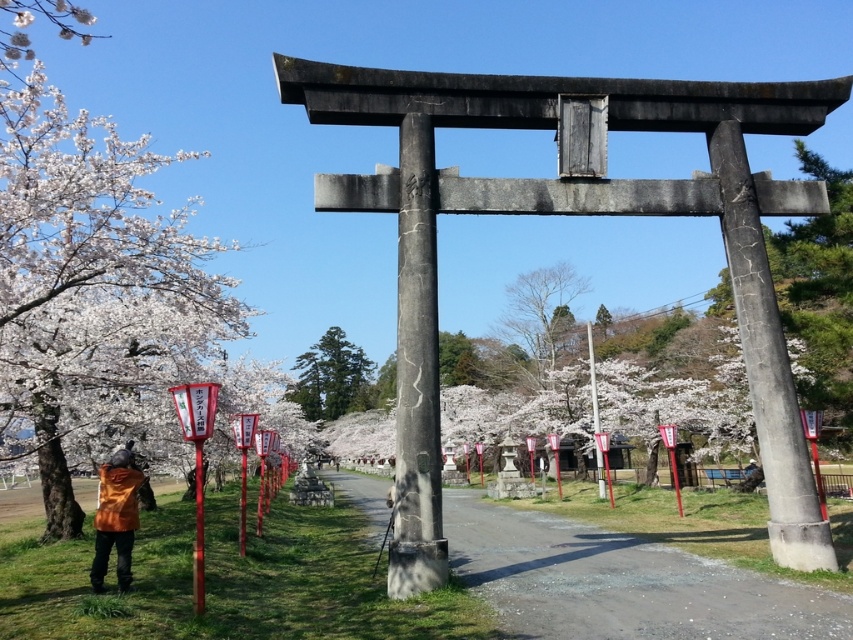
Question: Does smooth asphalt path at center appear over dark gray stone pole at center?

Choices:
 (A) no
 (B) yes

Answer: (A)

Question: Does dark gray stone pole at center appear over bare wood tree at center?

Choices:
 (A) yes
 (B) no

Answer: (A)

Question: Which object is positioned farthest from the dark gray stone pole at center?

Choices:
 (A) smooth asphalt path at center
 (B) orange fabric jacket at lower left
 (C) bare wood tree at center
 (D) green textured tree at center

Answer: (D)

Question: Which object is the closest to the smooth asphalt path at center?

Choices:
 (A) dark gray stone pole at center
 (B) bare wood tree at center
 (C) orange fabric jacket at lower left

Answer: (C)

Question: Which point is farther to the camera?

Choices:
 (A) (538, 289)
 (B) (337, 348)
 (C) (827, 256)
 (D) (56, 100)

Answer: (B)

Question: Can you confirm if dark gray stone pole at center is wider than orange fabric jacket at lower left?

Choices:
 (A) no
 (B) yes

Answer: (A)